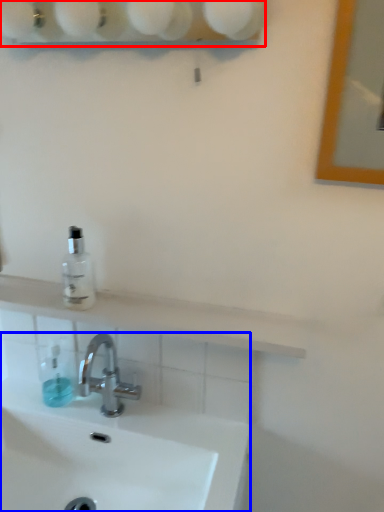
Question: Which object appears closest to the camera in this image, shelf (highlighted by a red box) or sink (highlighted by a blue box)?

Choices:
 (A) shelf
 (B) sink

Answer: (A)